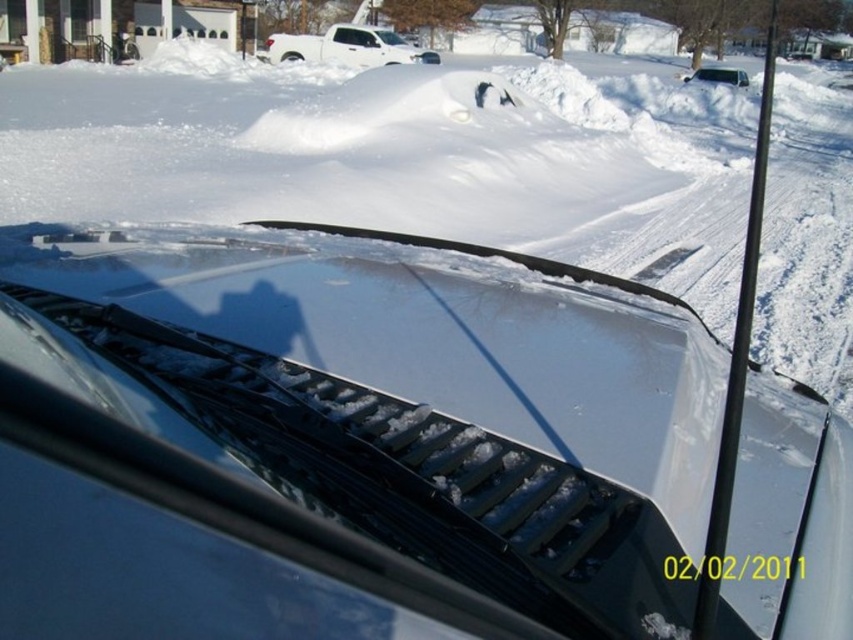
Question: In this image, where is white fluffy snow at center located relative to white matte truck at upper center?

Choices:
 (A) left
 (B) right

Answer: (B)

Question: Does white matte truck at upper center appear under white matte van at upper center?

Choices:
 (A) yes
 (B) no

Answer: (B)

Question: Based on their relative distances, which object is nearer to the sleek silver hood at center?

Choices:
 (A) white matte van at upper center
 (B) white matte truck at upper center

Answer: (A)

Question: Is white matte truck at upper center above white matte van at upper center?

Choices:
 (A) no
 (B) yes

Answer: (B)

Question: Which object is positioned farthest from the white matte truck at upper center?

Choices:
 (A) white matte van at upper center
 (B) white fluffy snow at center

Answer: (A)

Question: Which is farther from the sleek silver hood at center?

Choices:
 (A) white fluffy snow at center
 (B) white matte van at upper center
 (C) white matte truck at upper center

Answer: (C)